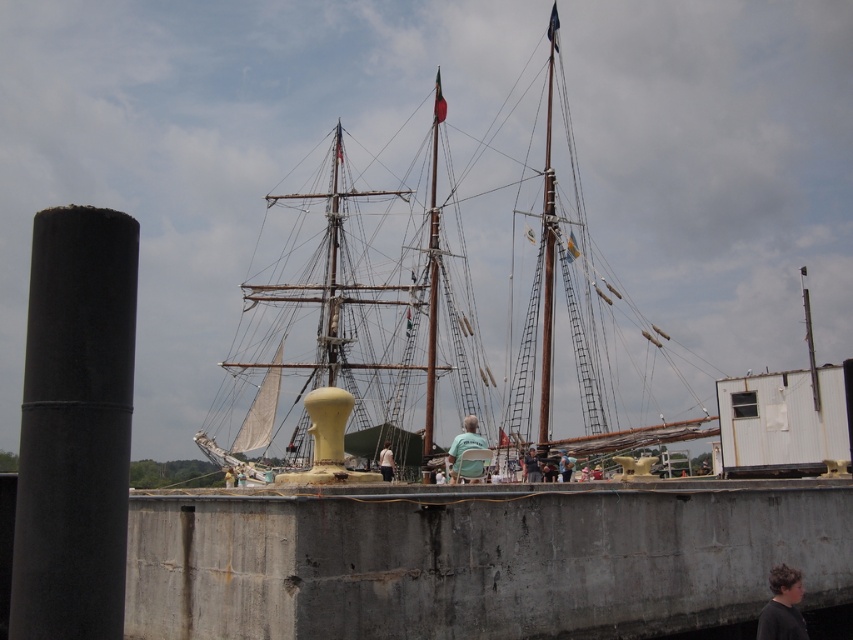
Question: In this image, where is green fabric chair at center located relative to blue denim shirt at center?

Choices:
 (A) right
 (B) left

Answer: (B)

Question: Among these points, which one is farthest from the camera?

Choices:
 (A) (529, 467)
 (B) (496, 253)

Answer: (B)

Question: Which is nearer to the wooden ship at center?

Choices:
 (A) dark gray shirt at lower right
 (B) black matte cylinder at left
 (C) light blue denim jacket at center

Answer: (C)

Question: Can you confirm if dark gray shirt at lower right is positioned above green fabric chair at center?

Choices:
 (A) no
 (B) yes

Answer: (A)

Question: Among these objects, which one is nearest to the camera?

Choices:
 (A) light blue denim jacket at center
 (B) wooden ship at center

Answer: (B)

Question: Observing the image, what is the correct spatial positioning of blue denim shirt at center in reference to light blue denim jacket at center?

Choices:
 (A) right
 (B) left

Answer: (A)